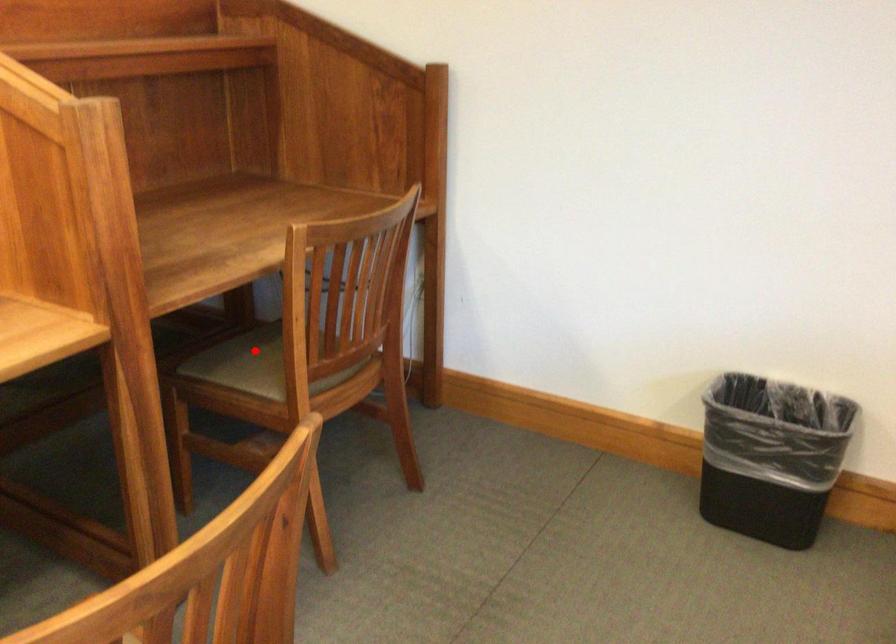
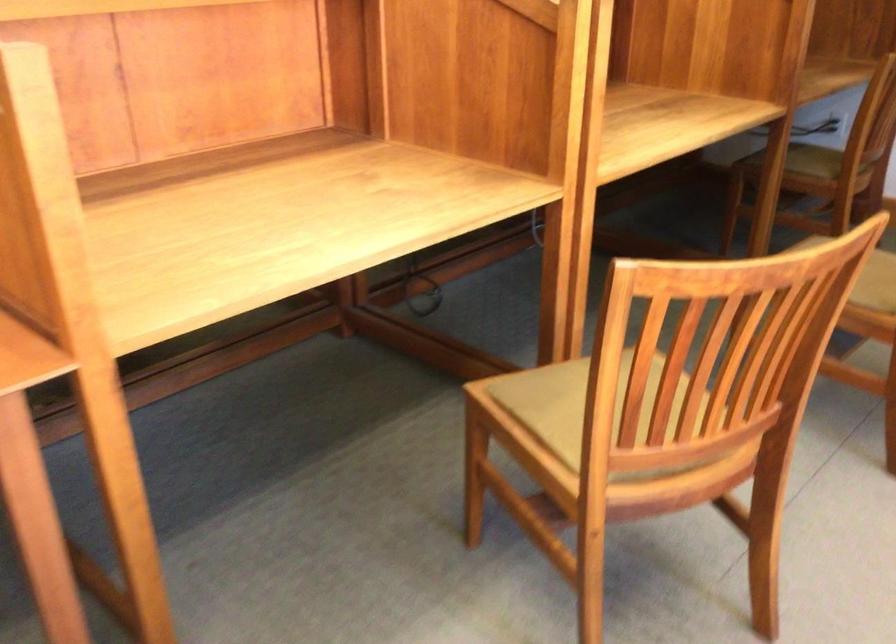
Question: I am providing you with two images of the same scene from different viewpoints. A red point is marked on the first image. Is the red point's position out of view in image 2?

Choices:
 (A) Yes
 (B) No

Answer: (A)